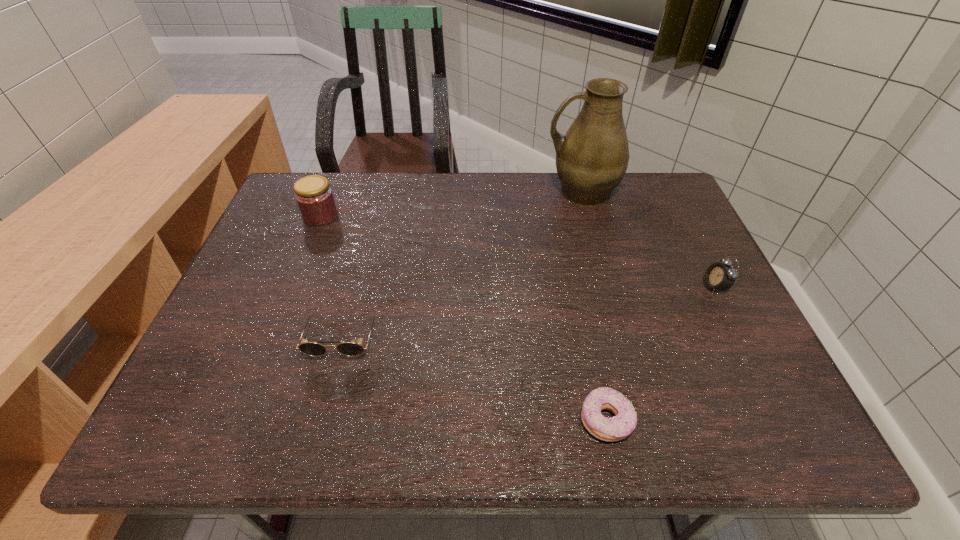
Locate an element on the screen. vacant space that's between the third shortest object and the nearest object is located at coordinates (660, 354).

This screenshot has height=540, width=960. Identify the location of vacant point located between the nearest object and the tallest object. (593, 306).

Where is `unoccupied area between the nearest object and the second object from left to right`? Image resolution: width=960 pixels, height=540 pixels. unoccupied area between the nearest object and the second object from left to right is located at coordinates (474, 379).

I want to click on free space between the third shortest object and the fourth object from right to left, so click(x=529, y=312).

Where is `empty space between the fourth object from right to left and the alarm clock`? The image size is (960, 540). empty space between the fourth object from right to left and the alarm clock is located at coordinates (529, 312).

Locate an element on the screen. vacant space that's between the tallest object and the jam is located at coordinates (451, 204).

Locate an element on the screen. The height and width of the screenshot is (540, 960). free space that is in between the pitcher and the sunglasses is located at coordinates (462, 265).

Where is `free space between the shortest object and the sunglasses`? Image resolution: width=960 pixels, height=540 pixels. free space between the shortest object and the sunglasses is located at coordinates (474, 379).

Where is `vacant area that lies between the fourth farthest object and the pitcher`? This screenshot has height=540, width=960. vacant area that lies between the fourth farthest object and the pitcher is located at coordinates (462, 265).

Locate an element on the screen. empty space that is in between the jam and the fourth tallest object is located at coordinates (332, 277).